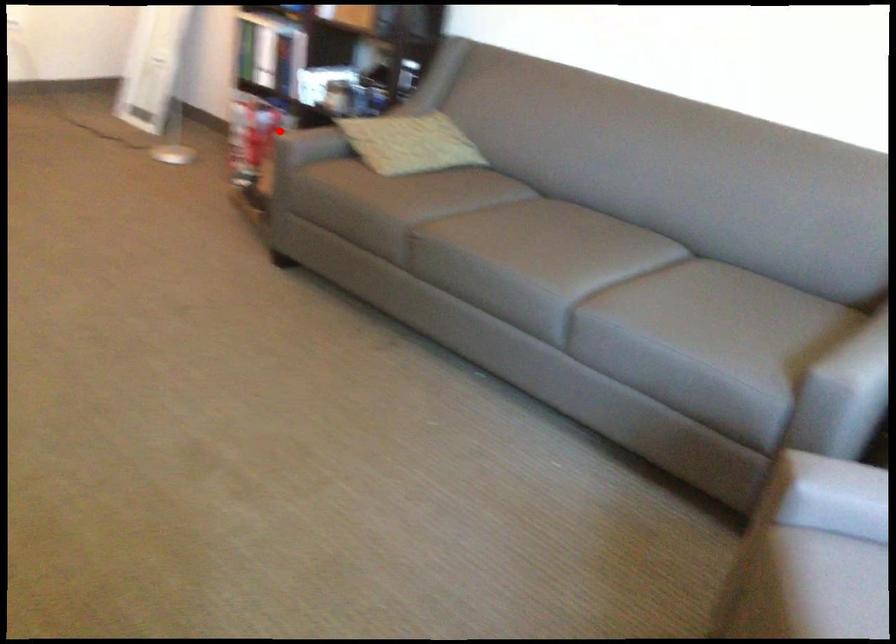
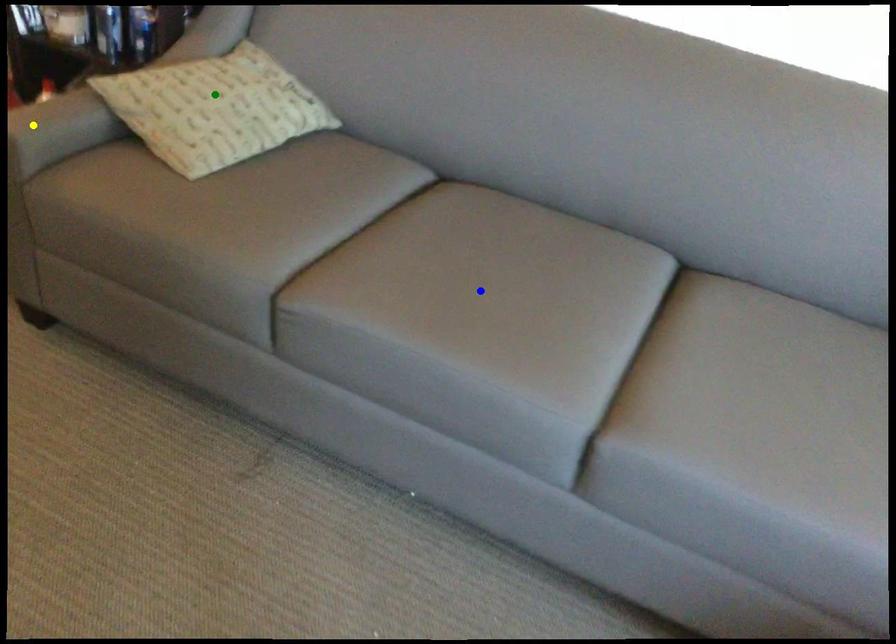
Question: I am providing you with two images of the same scene from different viewpoints. A red point is marked on the first image. You are given multiple points on the second image. Which point in image 2 represents the same 3d spot as the red point in image 1?

Choices:
 (A) yellow point
 (B) blue point
 (C) green point

Answer: (A)